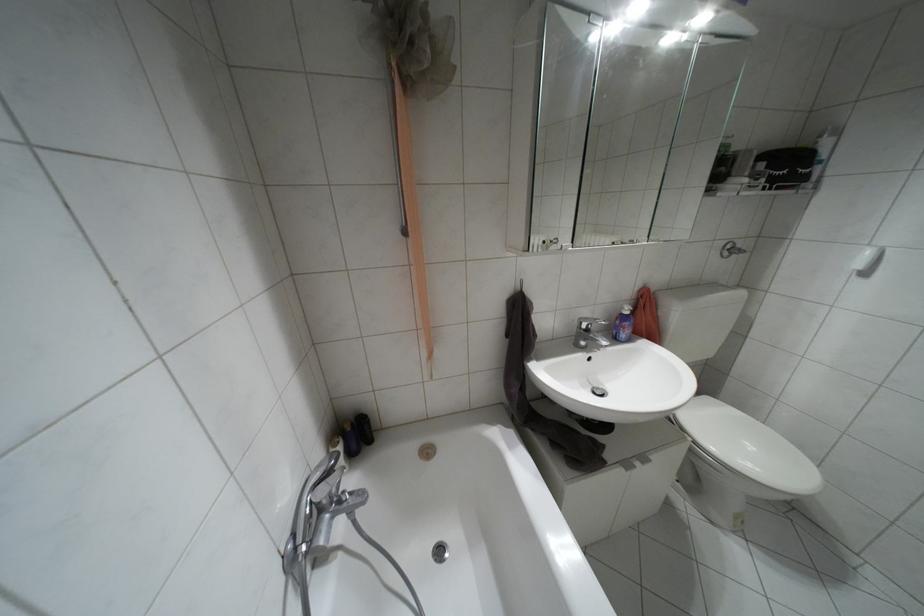
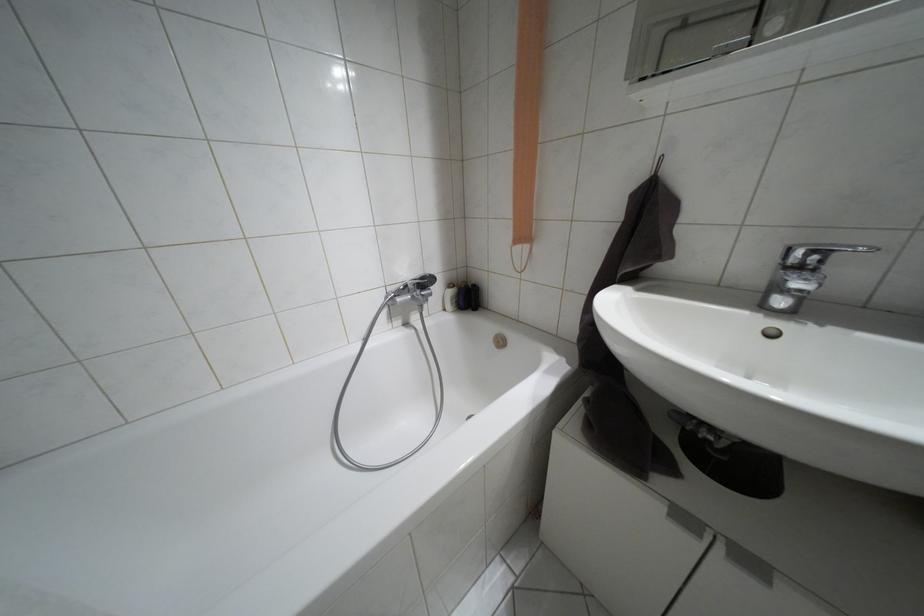
Find the pixel in the second image that matches point (626, 464) in the first image.

(684, 517)